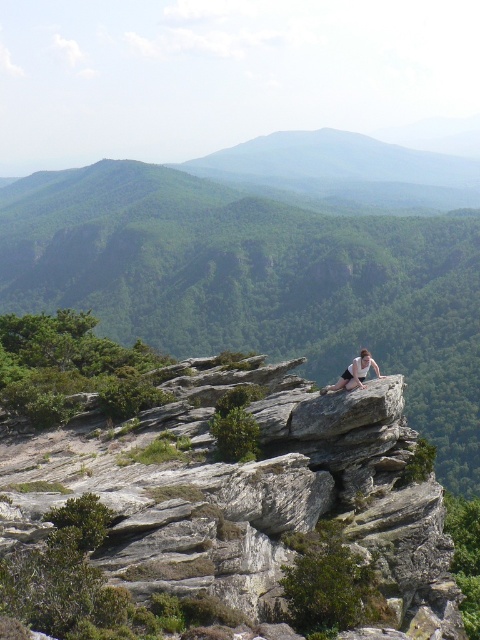
You are a hiker planning to take a photo of the green matte mountain at center and the light brown skin at center from a distance. Which object will appear bigger in your camera viewfinder?

The green matte mountain at center will appear bigger in the camera viewfinder since it has a larger size compared to the light brown skin at center.

Looking at this image, you are a hiker standing on the gray rough rock at center. You want to climb to the top of the green matte mountain at center. Which direction should you go to reach the mountain?

The gray rough rock at center is shorter than the green matte mountain at center, so you should go upward from the gray rough rock at center towards the green matte mountain at center to reach the mountain.

You are standing on the rocky outcrop and want to place a small flag at each of the two points marked in the image. The first flag is at point (381, 547) and the second at point (362, 364). If you look towards the valley below, which flag will appear closer to you?

The flag at point (381, 547) will appear closer to you because it is in front of the flag at point (362, 364) according to their spatial positions.